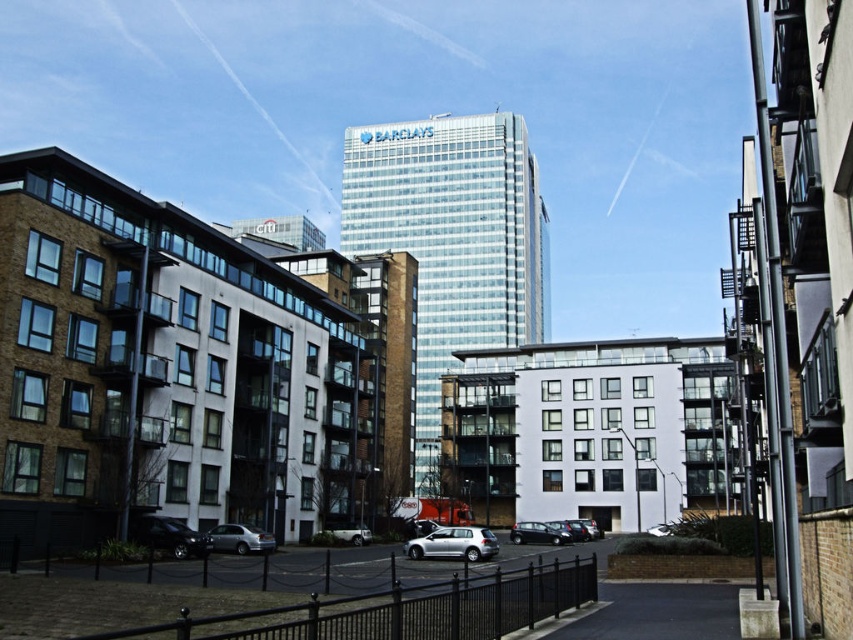
Question: Can you confirm if shiny black sedan at center is positioned to the right of metallic silver car at center?

Choices:
 (A) yes
 (B) no

Answer: (B)

Question: Does satin silver sedan at lower left have a larger size compared to shiny black sedan at center?

Choices:
 (A) yes
 (B) no

Answer: (B)

Question: Which object appears farthest from the camera in this image?

Choices:
 (A) shiny black sedan at lower left
 (B) satin silver car at center
 (C) satin silver sedan at lower left
 (D) silver metallic car at center

Answer: (D)

Question: Does shiny black sedan at lower left have a larger size compared to satin silver sedan at lower left?

Choices:
 (A) no
 (B) yes

Answer: (A)

Question: Estimate the real-world distances between objects in this image. Which object is farther from the satin silver car at center?

Choices:
 (A) metallic silver car at center
 (B) silver metallic car at center

Answer: (A)

Question: Which object appears farthest from the camera in this image?

Choices:
 (A) silver metallic car at center
 (B) satin silver sedan at lower left
 (C) shiny black sedan at lower left
 (D) metallic silver car at center

Answer: (A)